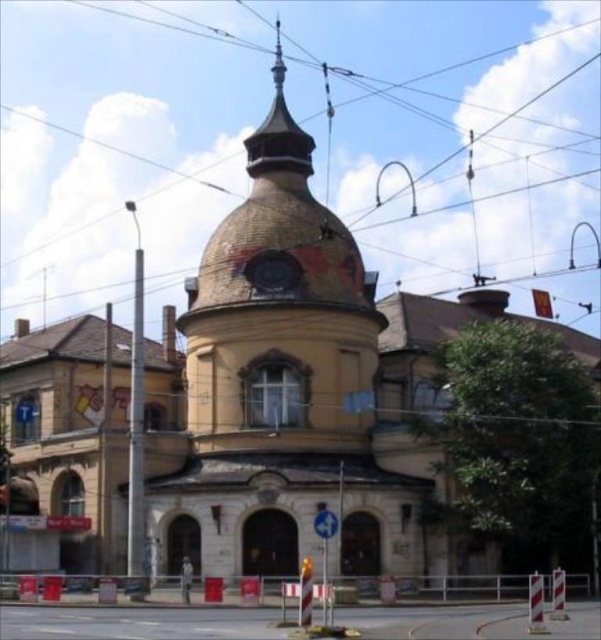
Question: Can you confirm if brown textured dome at center is smaller than gold textured spire at upper center?

Choices:
 (A) yes
 (B) no

Answer: (A)

Question: Based on their relative distances, which object is nearer to the brown textured dome at center?

Choices:
 (A) shiny silver spire at upper center
 (B) gold textured spire at upper center

Answer: (B)

Question: Does brown textured dome at center have a lesser width compared to shiny silver spire at upper center?

Choices:
 (A) yes
 (B) no

Answer: (B)

Question: Does brown textured dome at center have a greater width compared to shiny silver spire at upper center?

Choices:
 (A) yes
 (B) no

Answer: (A)

Question: Which object is the farthest from the shiny silver spire at upper center?

Choices:
 (A) gold textured spire at upper center
 (B) brown textured dome at center

Answer: (B)

Question: Which of these objects is positioned closest to the shiny silver spire at upper center?

Choices:
 (A) brown textured dome at center
 (B) gold textured spire at upper center

Answer: (B)